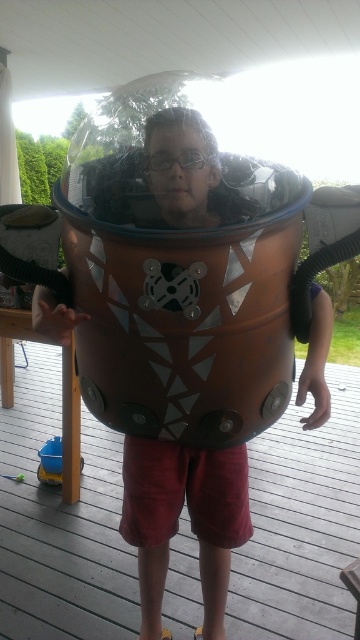
You are a guest at a family gathering and spot the matte brown helmet at center and the blue plastic toy at lower left in the garden. Which object is closer to the left side of the image?

The blue plastic toy at lower left is closer to the left side of the image because the matte brown helmet at center is to the right of it.

You are a photographer trying to capture a clear photo of the matte brown helmet at center without the blue plastic toy at lower left appearing in the frame. Based on their positions, is this possible?

The matte brown helmet at center is in front of the blue plastic toy at lower left, so if you position the camera so that the helmet blocks the view of the toy, you can take a clear photo of the helmet without the toy appearing in the frame.